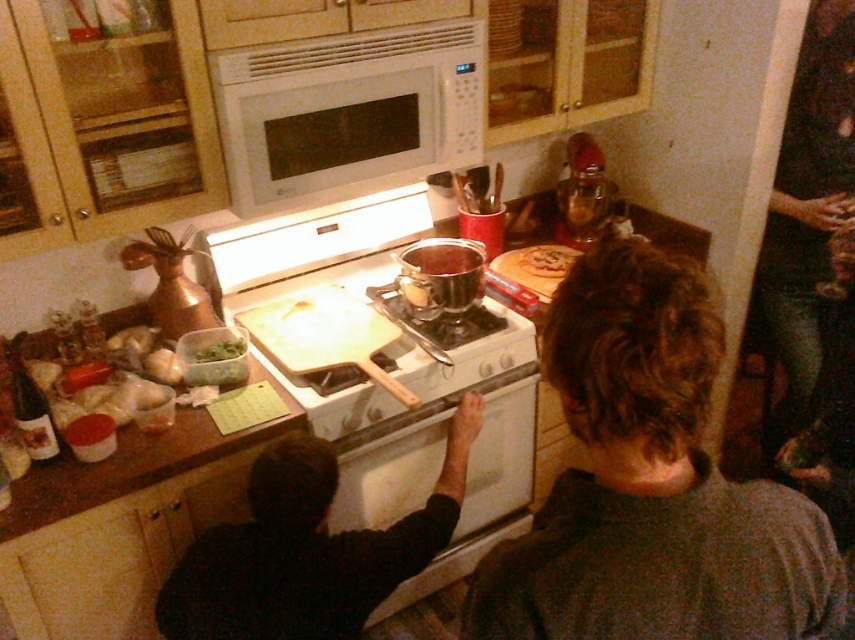
You are a chef observing the kitchen scene. You notice the dark brown hair at center and the jeans at right. From your perspective, which object is positioned to the left?

The dark brown hair at center is to the left of the jeans at right.

You are a chef preparing a meal and need to reach for the golden brown pastry at upper center. However, there is a pair of jeans at right in your way. Considering their heights, can you easily access the pastry without moving the jeans?

The jeans at right is much taller than the golden brown pastry at upper center. Since the jeans are taller, they might block your view or access to the pastry. You may need to move the jeans at right to reach the pastry easily.